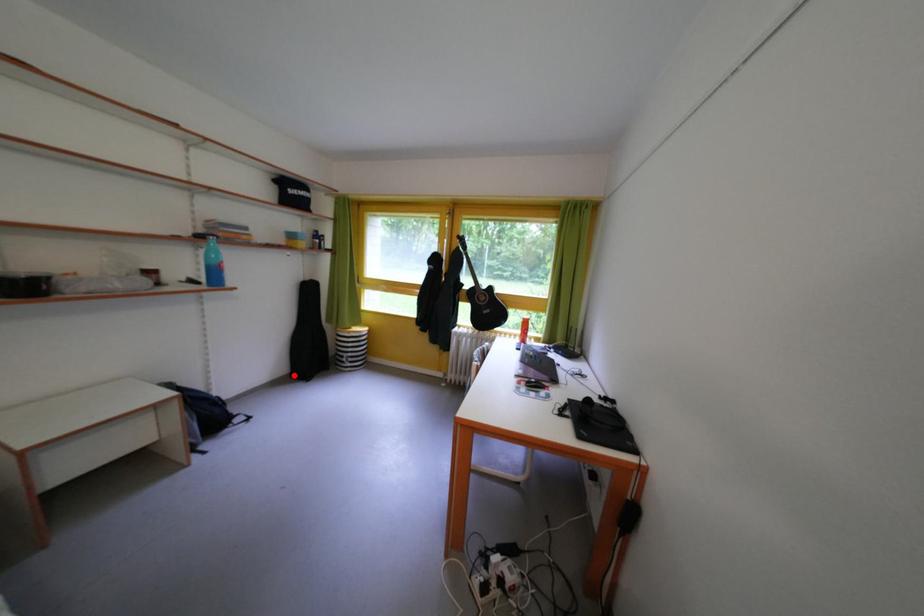
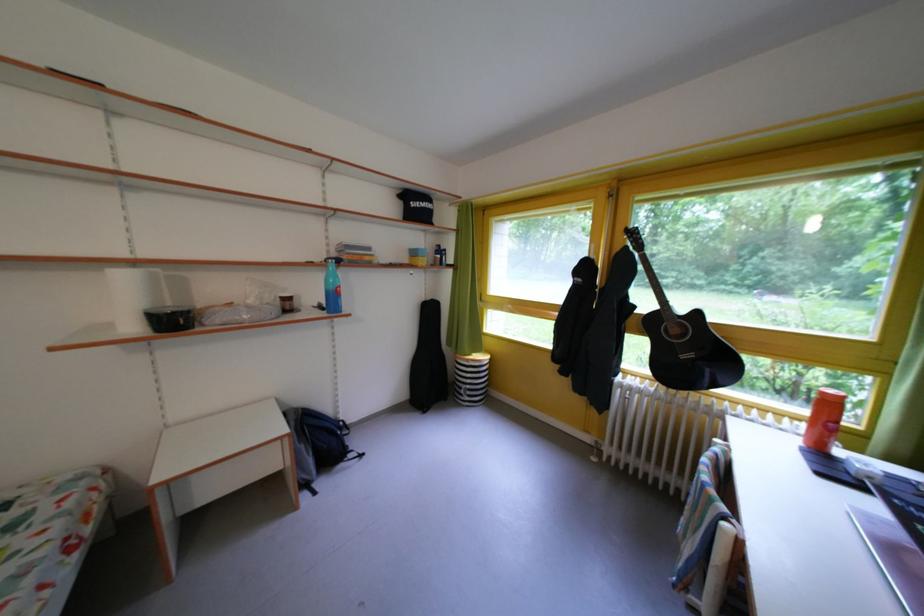
Question: I am providing you with two images of the same scene from different viewpoints. A red point is shown in image1. For the corresponding object point in image2, is it positioned nearer or farther from the camera?

Choices:
 (A) Nearer
 (B) Farther

Answer: (A)